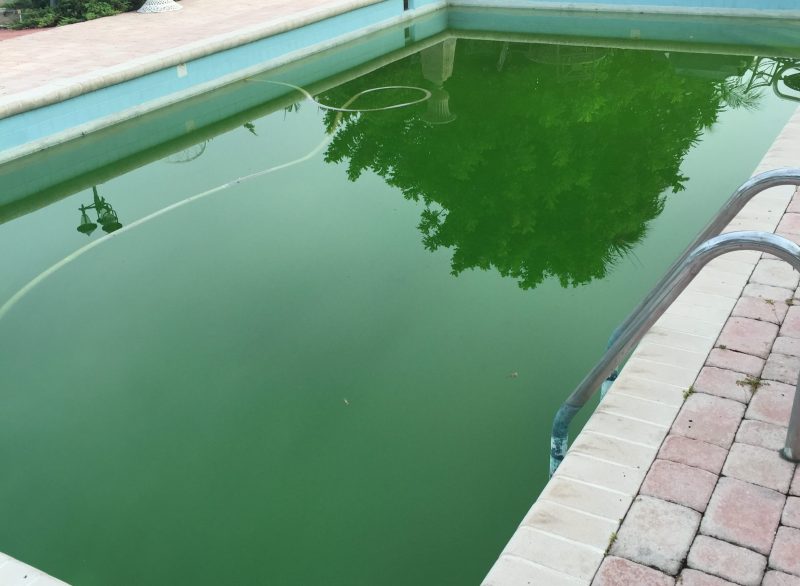
Image resolution: width=800 pixels, height=586 pixels. I want to click on ladder, so click(617, 338).